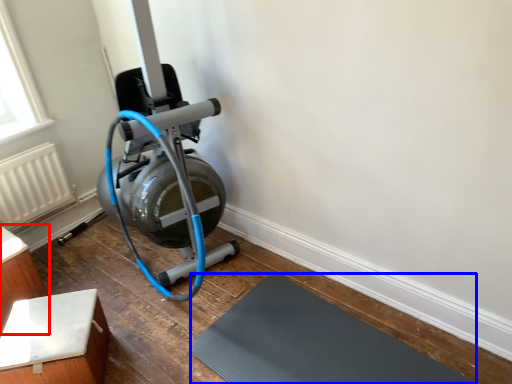
Question: Which point is closer to the camera, furniture (highlighted by a red box) or bath mat (highlighted by a blue box)?

Choices:
 (A) furniture
 (B) bath mat

Answer: (B)